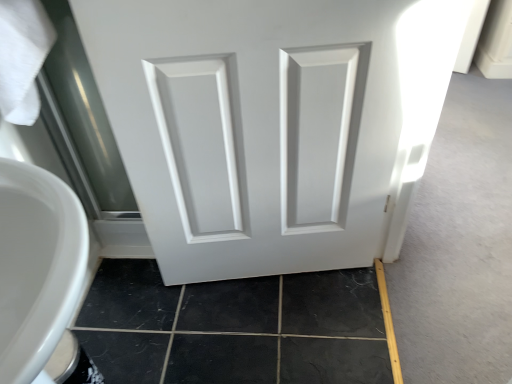
Question: Is white matte door at center in front of or behind black tile at lower left in the image?

Choices:
 (A) behind
 (B) front

Answer: (B)

Question: Looking at the image, does white matte door at center seem bigger or smaller compared to black tile at lower left?

Choices:
 (A) big
 (B) small

Answer: (A)

Question: From a real-world perspective, is white matte door at center above or below black tile at lower left?

Choices:
 (A) above
 (B) below

Answer: (A)

Question: From the image's perspective, relative to white matte door at center, is black tile at lower left above or below?

Choices:
 (A) above
 (B) below

Answer: (B)

Question: Which is correct: black tile at lower left is inside white matte door at center, or outside of it?

Choices:
 (A) outside
 (B) inside

Answer: (A)

Question: Looking at their shapes, would you say black tile at lower left is wider or thinner than white matte door at center?

Choices:
 (A) thin
 (B) wide

Answer: (B)

Question: In the image, is black tile at lower left positioned in front of or behind white matte door at center?

Choices:
 (A) behind
 (B) front

Answer: (A)